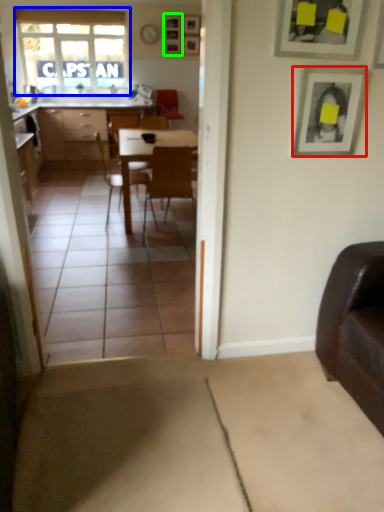
Question: Based on their relative distances, which object is farther from picture frame (highlighted by a red box)? Choose from window (highlighted by a blue box) and picture frame (highlighted by a green box).

Choices:
 (A) window
 (B) picture frame

Answer: (A)